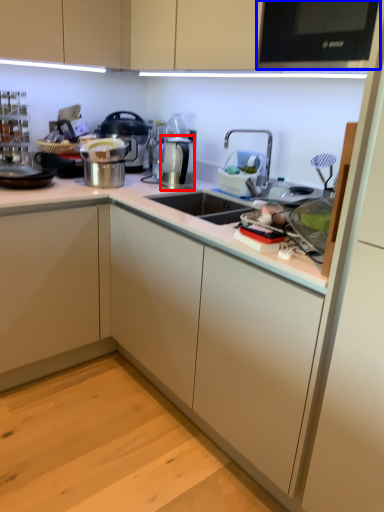
Question: Which point is further to the camera, appliance (highlighted by a red box) or home appliance (highlighted by a blue box)?

Choices:
 (A) appliance
 (B) home appliance

Answer: (A)